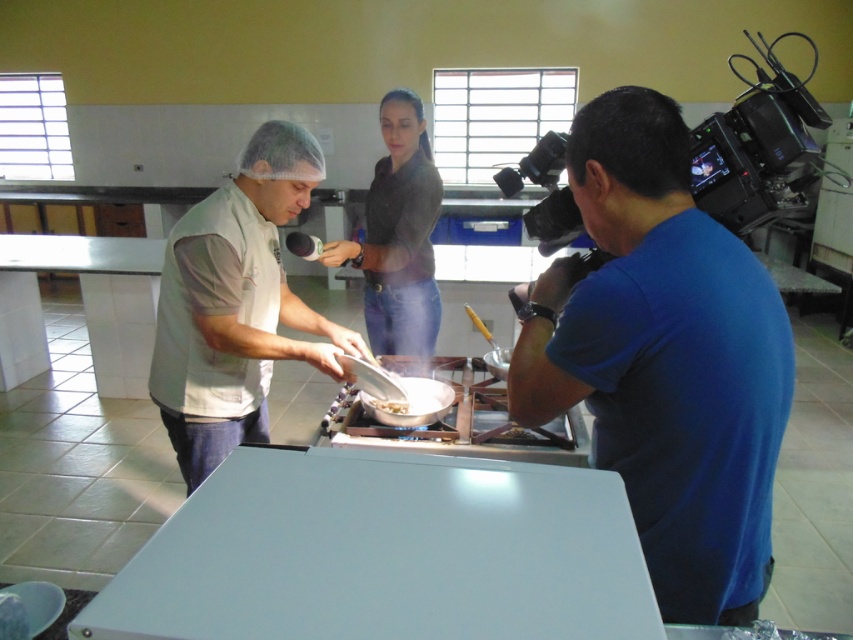
Who is taller, blue cotton shirt at right or white fabric chef hat at upper center?

white fabric chef hat at upper center

Looking at this image, does blue cotton shirt at right appear over white fabric chef hat at upper center?

No, blue cotton shirt at right is not above white fabric chef hat at upper center.

Looking at this image, who is more forward, (572, 404) or (178, 250)?

Point (572, 404) is in front.

You are a GUI agent. You are given a task and a screenshot of the screen. Output one action in this format:
    pyautogui.click(x=<x>, y=<y>)
    Task: Click on the blue cotton shirt at right
    The height and width of the screenshot is (640, 853).
    Given the screenshot: What is the action you would take?
    pyautogui.click(x=664, y=358)

Based on the photo, does black plastic video camera at right have a smaller size compared to white glossy table at left?

Actually, black plastic video camera at right might be larger than white glossy table at left.

Which is in front, point (717, 182) or point (111, 392)?

Positioned in front is point (717, 182).

At what (x,y) coordinates should I click in order to perform the action: click on black plastic video camera at right. Please return your answer as a coordinate pair (x, y). The height and width of the screenshot is (640, 853). Looking at the image, I should click on (758, 147).

Can you confirm if white glossy pan at center is bigger than white glossy food at center?

Correct, white glossy pan at center is larger in size than white glossy food at center.

Who is more forward, (x=444, y=436) or (x=404, y=406)?

Point (x=444, y=436)

Image resolution: width=853 pixels, height=640 pixels. Identify the location of white glossy pan at center. (467, 422).